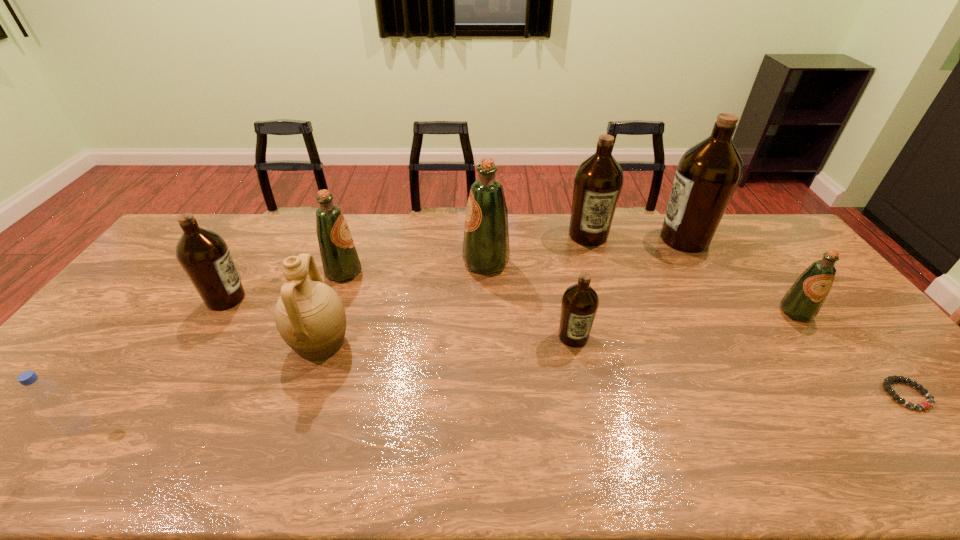
This screenshot has width=960, height=540. What are the coordinates of `pitcher` in the screenshot? It's located at (309, 315).

Identify the location of the fourth olive oil from right to left. This screenshot has height=540, width=960. (580, 302).

Find the location of a particular element. the nearest brown olive oil is located at coordinates (580, 302).

This screenshot has height=540, width=960. What are the coordinates of `the rightmost olive oil` in the screenshot? It's located at (802, 302).

Where is `the nearest green olive oil`? Image resolution: width=960 pixels, height=540 pixels. the nearest green olive oil is located at coordinates (802, 302).

The width and height of the screenshot is (960, 540). I want to click on the nearest object, so click(66, 415).

Where is `blue bottle`? blue bottle is located at coordinates (66, 415).

Image resolution: width=960 pixels, height=540 pixels. I want to click on black bracelet, so 887,382.

Locate an element on the screen. The width and height of the screenshot is (960, 540). the shortest object is located at coordinates (887, 382).

Image resolution: width=960 pixels, height=540 pixels. In order to click on free location located on the label of the rightmost brown olive oil in this screenshot , I will do `click(575, 239)`.